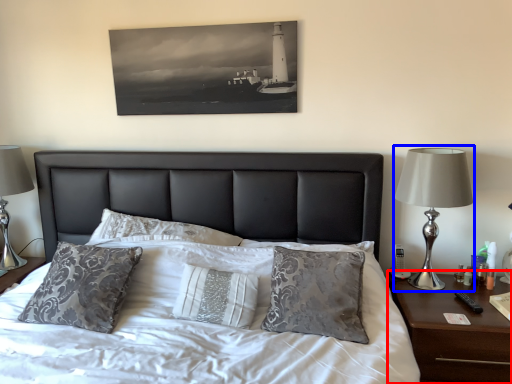
Question: Among these objects, which one is nearest to the camera, nightstand (highlighted by a red box) or bedside lamp (highlighted by a blue box)?

Choices:
 (A) nightstand
 (B) bedside lamp

Answer: (A)